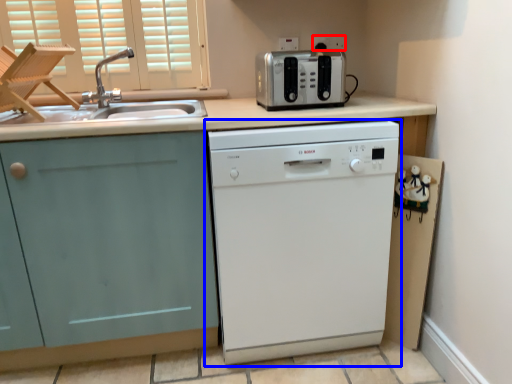
Question: Among these objects, which one is nearest to the camera, electric outlet (highlighted by a red box) or home appliance (highlighted by a blue box)?

Choices:
 (A) electric outlet
 (B) home appliance

Answer: (B)